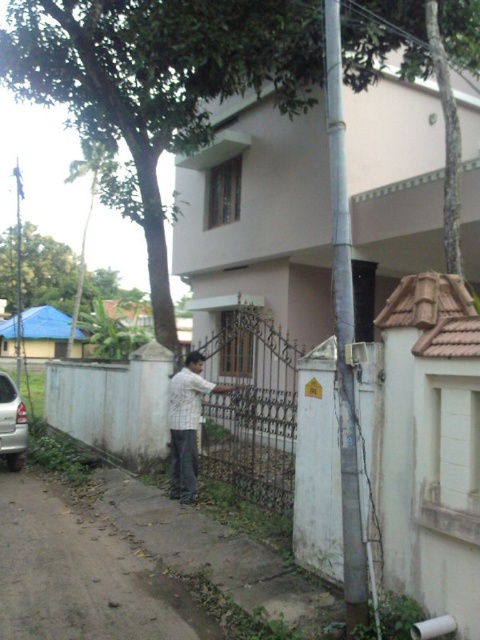
You are a delivery driver who needs to park your truck, which is 18 feet long, in the dirt road at lower left. Can your truck fit there?

The dirt road at lower left is 18.47 feet from the camera, so the truck can fit since it is slightly longer than the truck.

You are standing at the entrance of the property and want to walk through the black wrought iron gate at center. Based on its position coordinates, can you estimate how far to the right or left the gate is located relative to the center of the image?

The black wrought iron gate at center is located at coordinates point (252, 408), which means it is slightly to the right of the image center since the x coordinate is higher than 0.5. Therefore, you should move towards the right side to reach it.

You are standing at the entrance of the building and notice the green leafy tree at upper left and the striped shirt at center. Which object is closer to you?

The green leafy tree at upper left is closer to you because it is in front of the striped shirt at center.